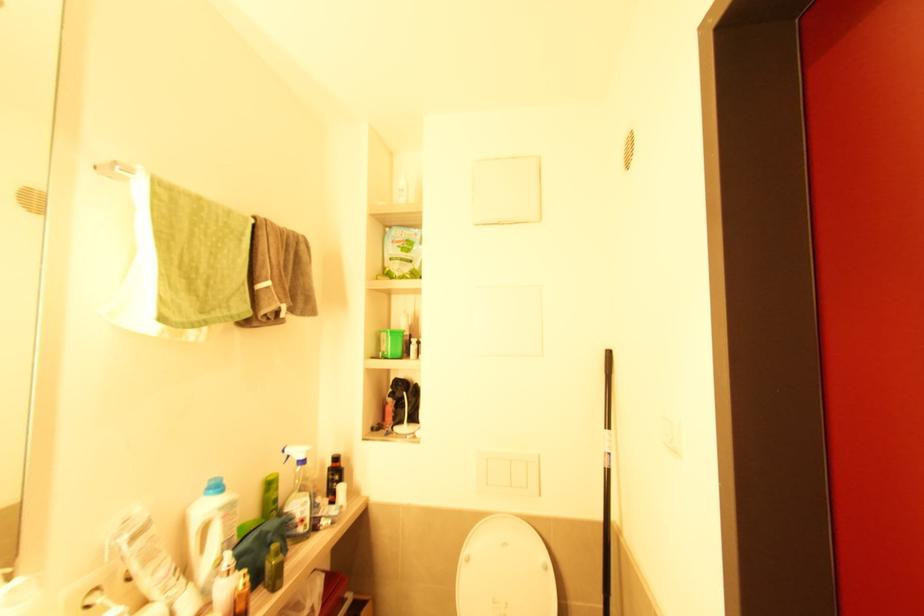
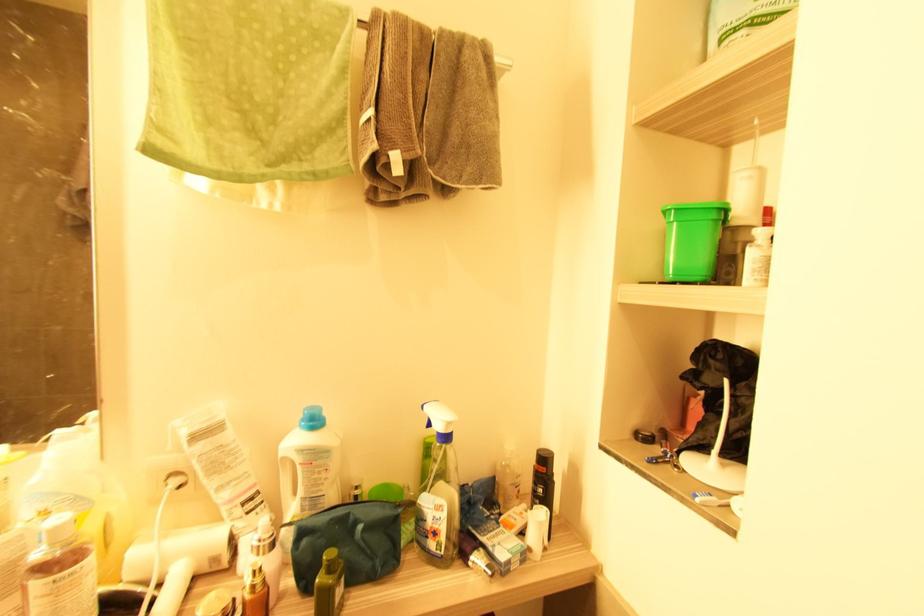
Question: Based on the continuous images, in which direction is the camera rotating? Reply with the corresponding letter.

Choices:
 (A) Left
 (B) Right
 (C) Up
 (D) Down

Answer: (A)